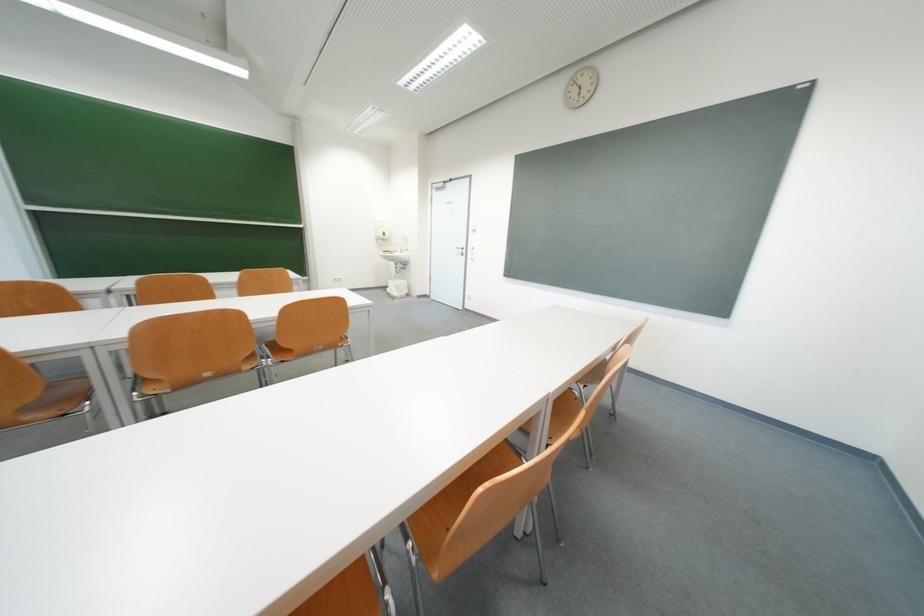
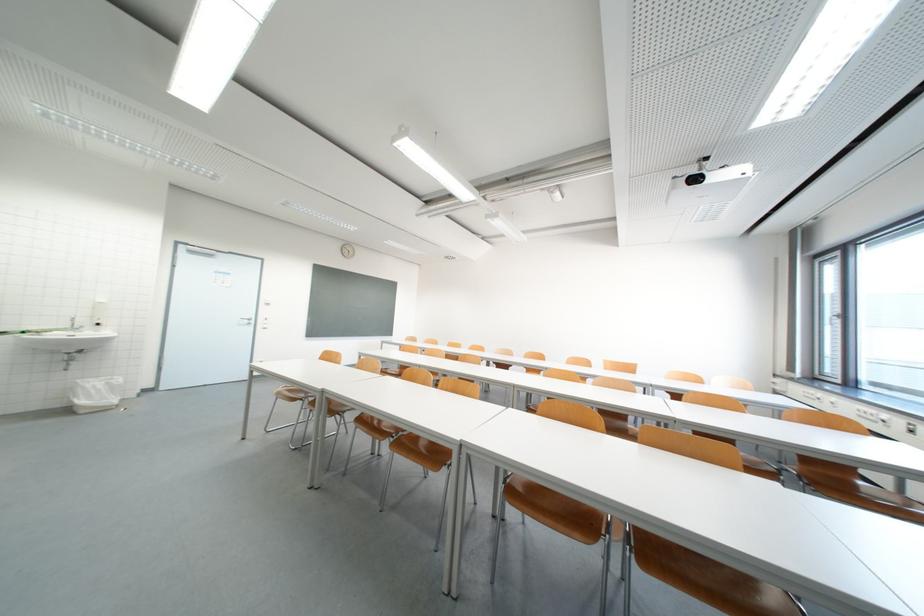
Find the pixel in the second image that matches (x=473, y=254) in the first image.

(261, 323)